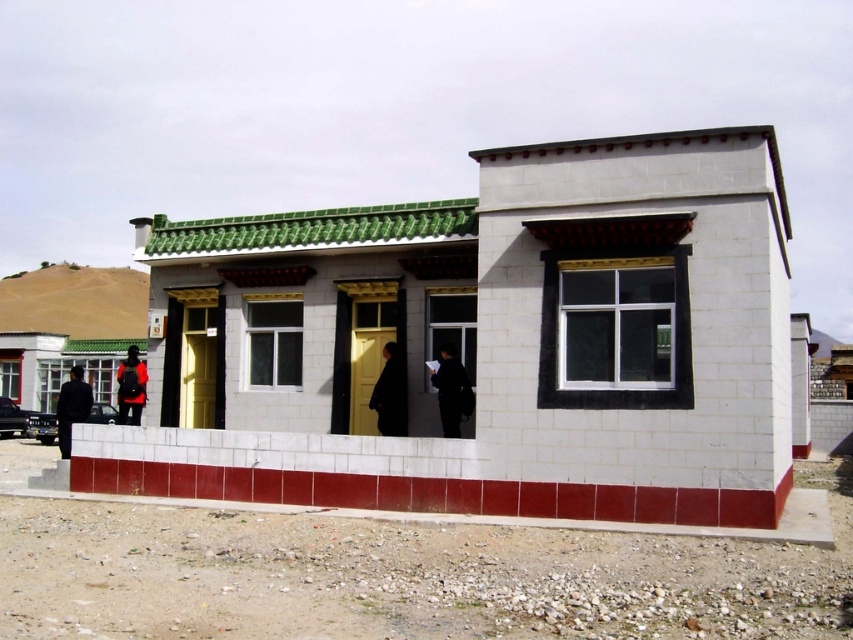
Consider the image. Which of these two, black matte suit at center or matte black backpack at lower left, stands taller?

matte black backpack at lower left

Who is more distant from viewer, (386, 401) or (138, 419)?

The point (138, 419) is more distant.

Locate an element on the screen. This screenshot has width=853, height=640. black matte suit at center is located at coordinates (389, 394).

Looking at this image, which of these two, dark blue fabric jacket at left or matte black backpack at lower left, stands taller?

dark blue fabric jacket at left

Between dark blue fabric jacket at left and matte black backpack at lower left, which one is positioned lower?

dark blue fabric jacket at left is below.

Image resolution: width=853 pixels, height=640 pixels. Describe the element at coordinates (71, 406) in the screenshot. I see `dark blue fabric jacket at left` at that location.

Where is `dark blue fabric jacket at left`? dark blue fabric jacket at left is located at coordinates (71, 406).

Does black matte jacket at center appear over dark blue fabric jacket at left?

Yes.

Which of these two, black matte jacket at center or dark blue fabric jacket at left, stands shorter?

black matte jacket at center

Image resolution: width=853 pixels, height=640 pixels. I want to click on black matte jacket at center, so click(x=451, y=390).